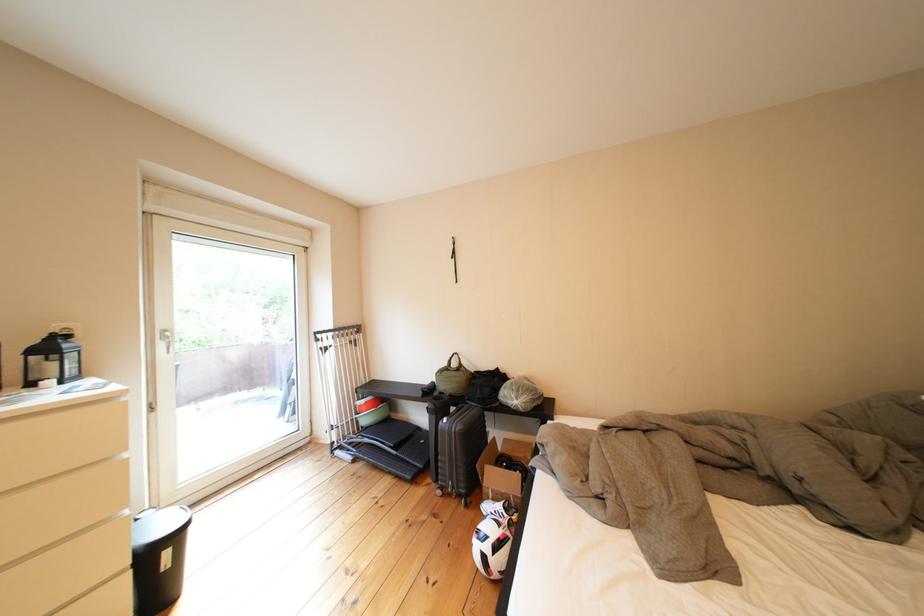
Where would you lift the black trash can? Please return your answer as a coordinate pair (x, y).

(159, 557)